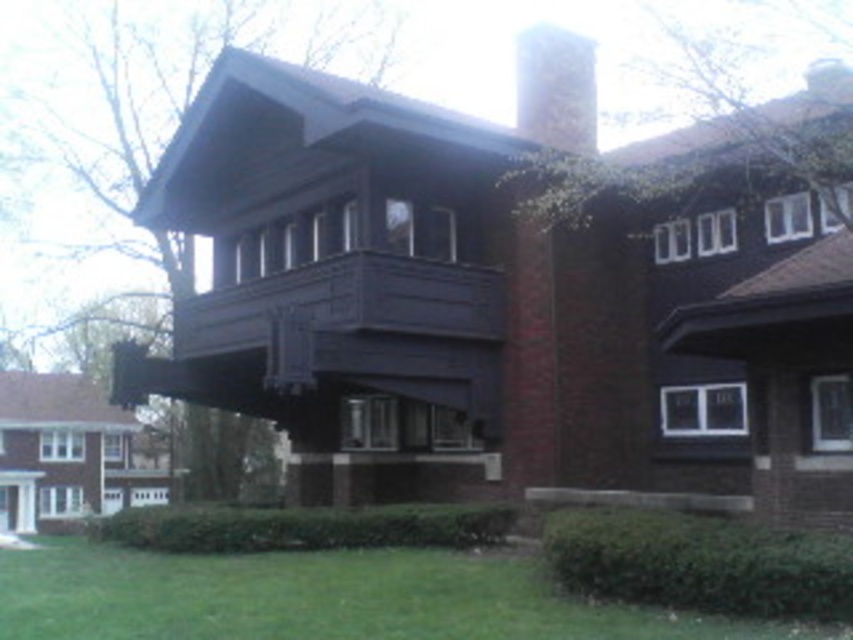
You are standing in front of the residential building and see a point marked at coordinates (328, 596). Based on the scene description, where is this point located in relation to the building?

The point is on green grass at lower center, which is part of the landscape surrounding the building, so it is located in the lower central area of the image, on the green grass near the building.